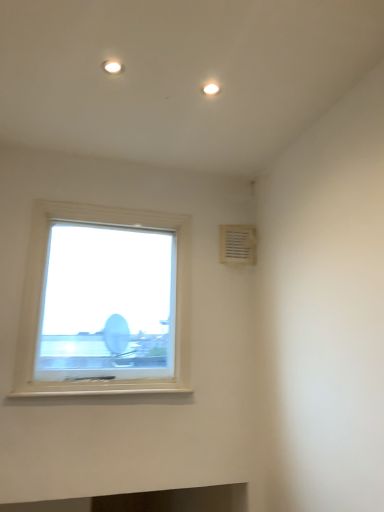
Question: Can you confirm if white plastic window at upper left is bigger than white plastic vent at upper right?

Choices:
 (A) yes
 (B) no

Answer: (A)

Question: Can you confirm if white plastic window at upper left is thinner than white plastic vent at upper right?

Choices:
 (A) yes
 (B) no

Answer: (B)

Question: Is white plastic window at upper left to the right of white plastic vent at upper right from the viewer's perspective?

Choices:
 (A) yes
 (B) no

Answer: (B)

Question: Is white plastic window at upper left not close to white plastic vent at upper right?

Choices:
 (A) no
 (B) yes

Answer: (A)

Question: Is white plastic window at upper left directly adjacent to white plastic vent at upper right?

Choices:
 (A) no
 (B) yes

Answer: (A)

Question: Can you confirm if white plastic window at upper left is taller than white plastic vent at upper right?

Choices:
 (A) yes
 (B) no

Answer: (A)

Question: Is white plastic vent at upper right positioned behind white plastic window at upper left?

Choices:
 (A) yes
 (B) no

Answer: (A)

Question: Can you see white plastic vent at upper right touching white plastic window at upper left?

Choices:
 (A) yes
 (B) no

Answer: (B)

Question: Considering the relative sizes of white plastic vent at upper right and white plastic window at upper left in the image provided, is white plastic vent at upper right thinner than white plastic window at upper left?

Choices:
 (A) yes
 (B) no

Answer: (A)

Question: Can you confirm if white plastic vent at upper right is shorter than white plastic window at upper left?

Choices:
 (A) no
 (B) yes

Answer: (B)

Question: Is white plastic vent at upper right not near white plastic window at upper left?

Choices:
 (A) yes
 (B) no

Answer: (B)

Question: Is white plastic vent at upper right turned away from white plastic window at upper left?

Choices:
 (A) yes
 (B) no

Answer: (B)

Question: Considering the relative positions of white plastic vent at upper right and white plastic window at upper left in the image provided, is white plastic vent at upper right to the left or to the right of white plastic window at upper left?

Choices:
 (A) right
 (B) left

Answer: (A)